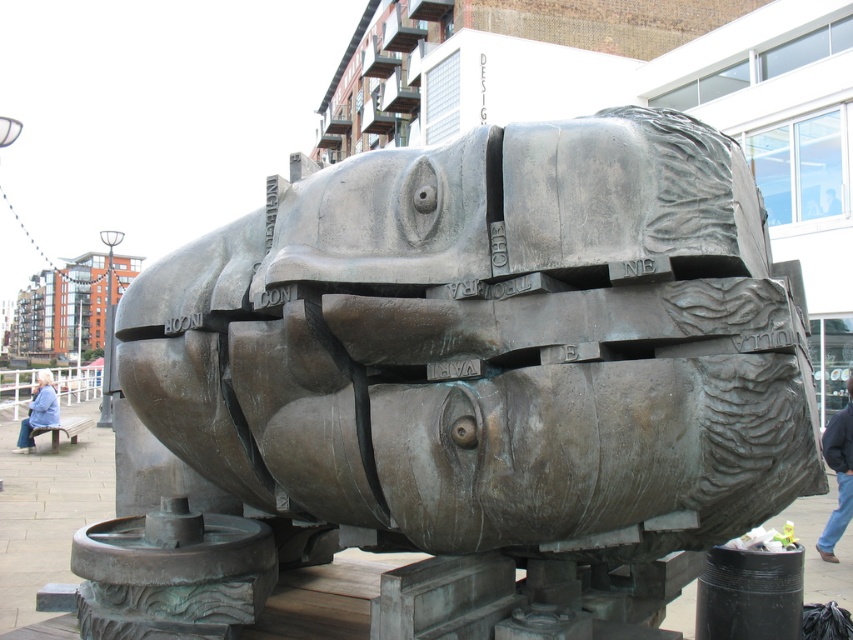
Which of these two, bronze fish at center or blue jeans at lower right, stands taller?

With more height is bronze fish at center.

Does bronze fish at center have a lesser width compared to blue jeans at lower right?

Incorrect, bronze fish at center's width is not less than blue jeans at lower right's.

Which is behind, point (537, 369) or point (848, 406)?

The point (848, 406) is behind.

Locate an element on the screen. The width and height of the screenshot is (853, 640). bronze fish at center is located at coordinates (492, 365).

Does bronze fish at center have a smaller size compared to blue denim jacket at lower left?

Yes.

Is bronze fish at center bigger than blue denim jacket at lower left?

Actually, bronze fish at center might be smaller than blue denim jacket at lower left.

Where is `bronze fish at center`? The width and height of the screenshot is (853, 640). bronze fish at center is located at coordinates (492, 365).

I want to click on bronze fish at center, so click(x=492, y=365).

Who is more forward, (x=839, y=417) or (x=15, y=448)?

Point (x=839, y=417)

Is the position of blue jeans at lower right more distant than that of blue denim jacket at lower left?

No, it is not.

Measure the distance between point (837, 529) and camera.

Point (837, 529) is 10.90 meters from camera.

What are the coordinates of `blue jeans at lower right` in the screenshot? It's located at (838, 474).